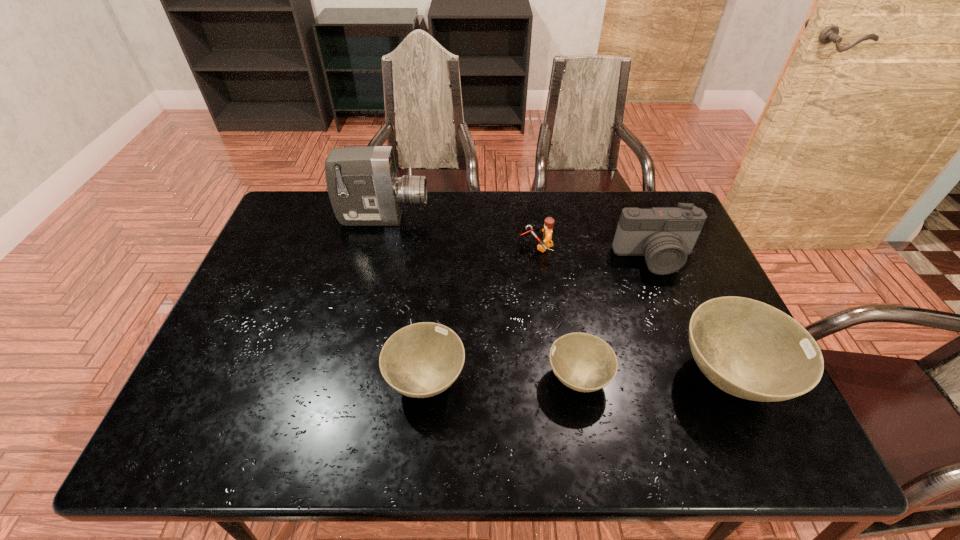
Locate an element on the screen. Image resolution: width=960 pixels, height=540 pixels. free point that keeps the bowls evenly spaced on the left is located at coordinates (274, 382).